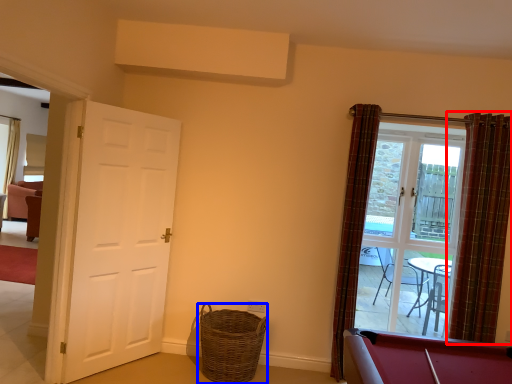
Question: Among these objects, which one is nearest to the camera, curtain (highlighted by a red box) or basket (highlighted by a blue box)?

Choices:
 (A) curtain
 (B) basket

Answer: (B)